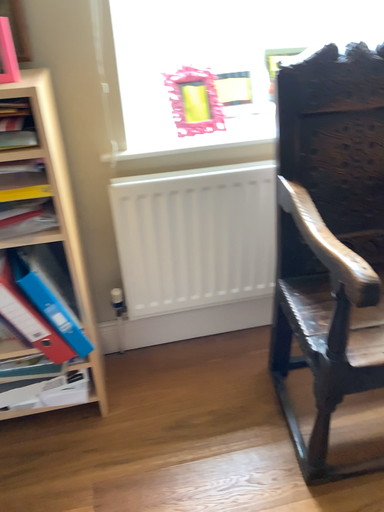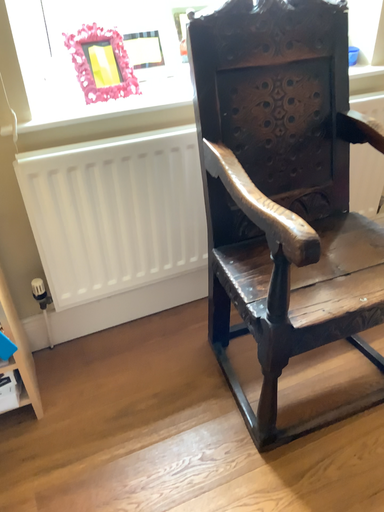
Question: Which way did the camera rotate in the video?

Choices:
 (A) rotated left
 (B) rotated right

Answer: (B)